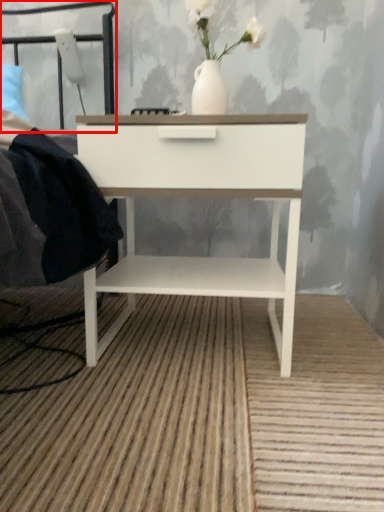
Question: Observing the image, what is the correct spatial positioning of headboard (annotated by the red box) in reference to nightstand?

Choices:
 (A) left
 (B) right

Answer: (A)